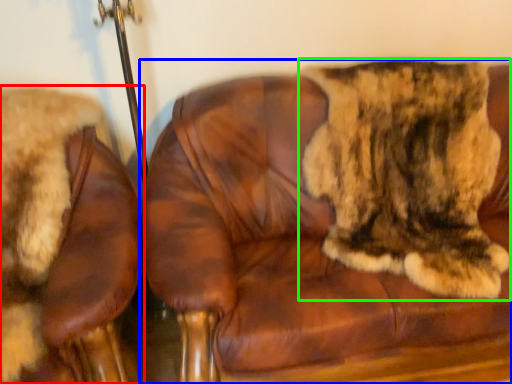
Question: Based on their relative distances, which object is farther from chair (highlighted by a red box)? Choose from chair (highlighted by a blue box) and cat (highlighted by a green box).

Choices:
 (A) chair
 (B) cat

Answer: (B)